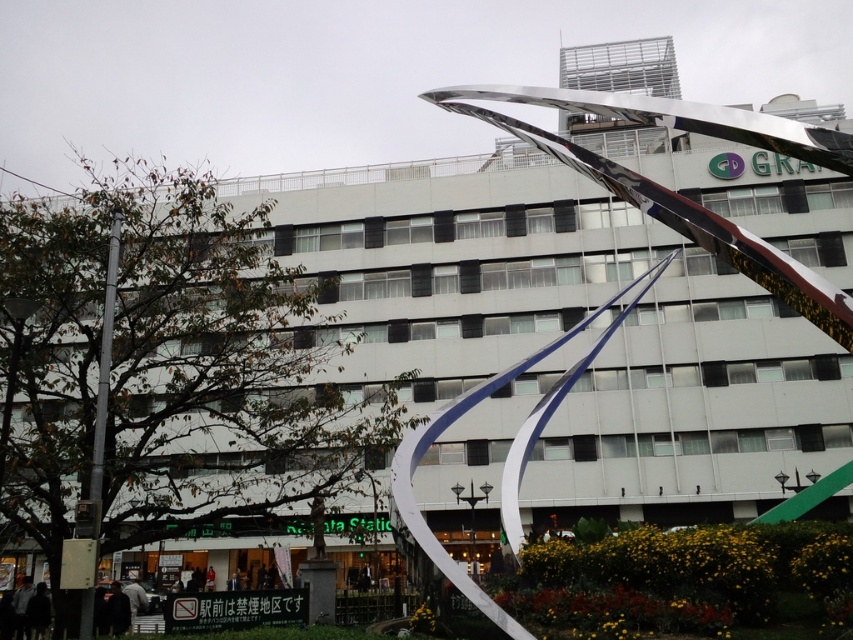
Consider the image. Is silver metallic pole at left wider than dark fabric jacket at lower left?

No.

Which of these two, silver metallic pole at left or dark fabric jacket at lower left, stands taller?

With more height is dark fabric jacket at lower left.

Is point (93, 442) positioned in front of point (120, 602)?

Yes, it is.

Where is `silver metallic pole at left`? Image resolution: width=853 pixels, height=640 pixels. silver metallic pole at left is located at coordinates (103, 362).